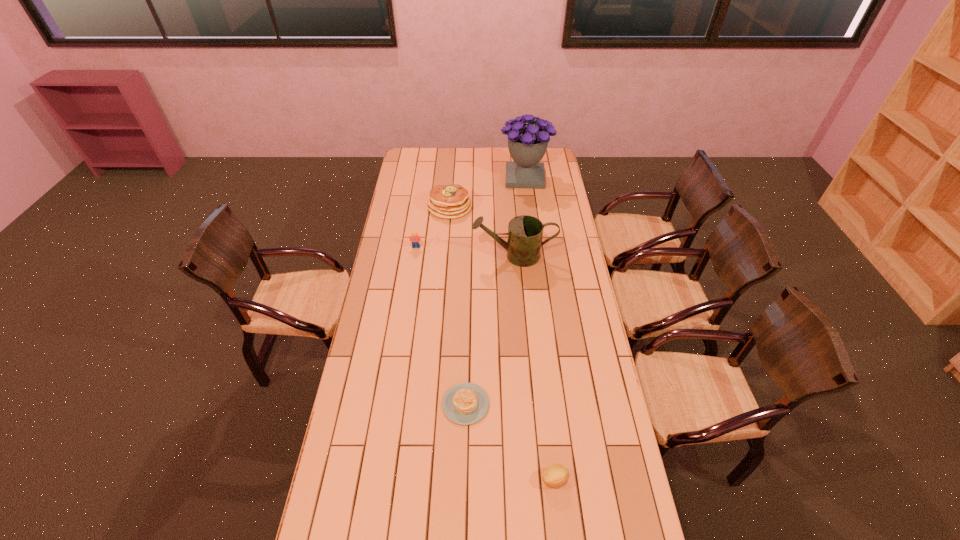
At what (x,y) coordinates should I click in order to perform the action: click on the farthest object. Please return your answer as a coordinate pair (x, y). The width and height of the screenshot is (960, 540). Looking at the image, I should click on (527, 143).

At what (x,y) coordinates should I click in order to perform the action: click on the tallest object. Please return your answer as a coordinate pair (x, y). Looking at the image, I should click on (527, 143).

The width and height of the screenshot is (960, 540). What are the coordinates of `watering can` in the screenshot? It's located at (525, 232).

The height and width of the screenshot is (540, 960). What are the coordinates of `the farther pancake` in the screenshot? It's located at (445, 201).

Where is `the fifth nearest object`? the fifth nearest object is located at coordinates (445, 201).

In order to click on Lego in this screenshot , I will do click(415, 239).

The height and width of the screenshot is (540, 960). I want to click on the fifth tallest object, so click(554, 475).

Where is `the nearest object`? the nearest object is located at coordinates (554, 475).

Where is `the shortest object`? Image resolution: width=960 pixels, height=540 pixels. the shortest object is located at coordinates tap(466, 403).

You are a GUI agent. You are given a task and a screenshot of the screen. Output one action in this format:
    pyautogui.click(x=<x>, y=<y>)
    Task: Click on the nearer pancake
    
    Given the screenshot: What is the action you would take?
    pyautogui.click(x=466, y=403)